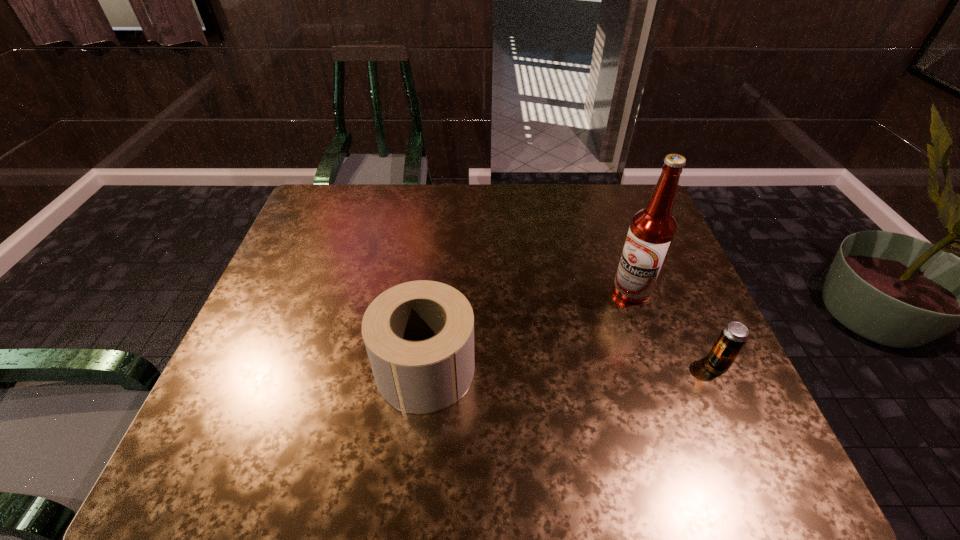
This screenshot has height=540, width=960. I want to click on the leftmost object, so click(419, 335).

In order to click on the second shortest object in this screenshot , I will do `click(419, 335)`.

Where is `the shortest object`? The image size is (960, 540). the shortest object is located at coordinates (733, 337).

Where is `the rightmost object`? the rightmost object is located at coordinates (733, 337).

The image size is (960, 540). What are the coordinates of `the second object from left to right` in the screenshot? It's located at (652, 230).

Identify the location of alcohol. The image size is (960, 540). (652, 230).

In order to click on free region located on the left of the toilet tissue in this screenshot , I will do `click(314, 369)`.

At what (x,y) coordinates should I click in order to perform the action: click on vacant space located 0.370m on the left of the rightmost object. Please return your answer as a coordinate pair (x, y). Image resolution: width=960 pixels, height=540 pixels. Looking at the image, I should click on point(543,364).

The width and height of the screenshot is (960, 540). I want to click on vacant space located 0.260m on the label side of the second object from left to right, so point(587,375).

The height and width of the screenshot is (540, 960). Find the location of `vacant area situated on the label side of the second object from left to right`. vacant area situated on the label side of the second object from left to right is located at coordinates (617, 318).